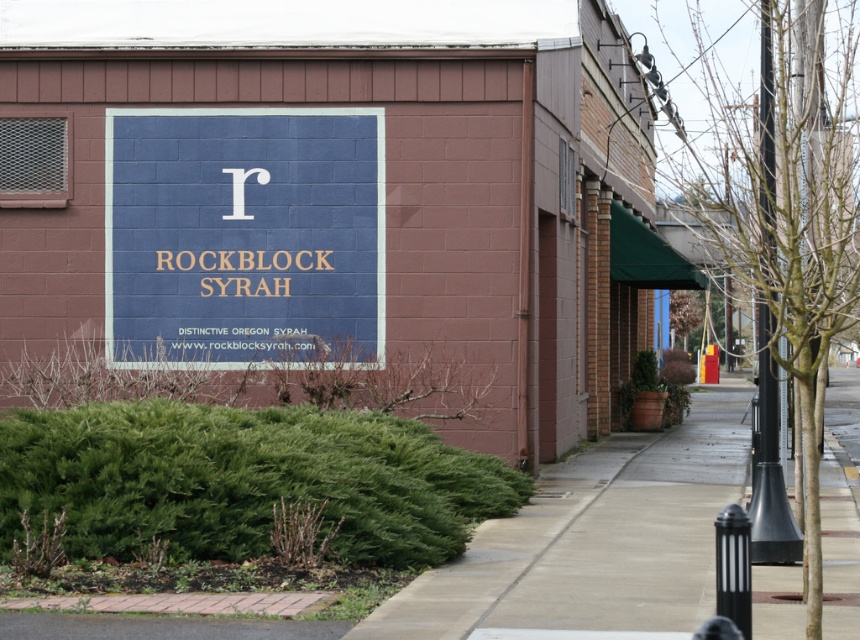
Can you confirm if blue painted sign at center is bigger than concrete sidewalk at center?

No, blue painted sign at center is not bigger than concrete sidewalk at center.

Find the location of a particular element. The image size is (860, 640). blue painted sign at center is located at coordinates (243, 232).

Where is `blue painted sign at center`? The width and height of the screenshot is (860, 640). blue painted sign at center is located at coordinates (243, 232).

Is green leafy bush at lower center to the left of concrete sidewalk at center from the viewer's perspective?

Yes, green leafy bush at lower center is to the left of concrete sidewalk at center.

You are a GUI agent. You are given a task and a screenshot of the screen. Output one action in this format:
    pyautogui.click(x=<x>, y=<y>)
    Task: Click on the green leafy bush at lower center
    This screenshot has height=640, width=860.
    Given the screenshot: What is the action you would take?
    pyautogui.click(x=244, y=481)

Find the location of `green leafy bush at lower center`. green leafy bush at lower center is located at coordinates (244, 481).

How distant is blue painted sign at center from green leafy bush at lower center?

The distance of blue painted sign at center from green leafy bush at lower center is 4.93 meters.

Between blue painted sign at center and green leafy bush at lower center, which one appears on the right side from the viewer's perspective?

Positioned to the right is green leafy bush at lower center.

This screenshot has height=640, width=860. I want to click on blue painted sign at center, so click(x=243, y=232).